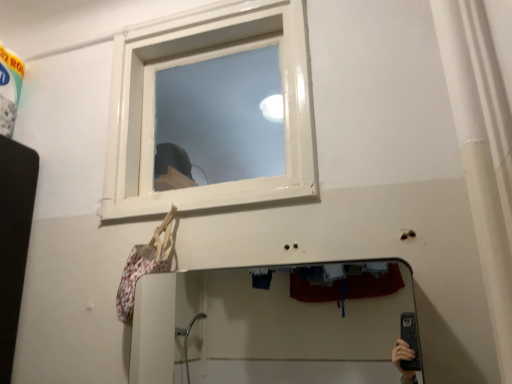
Find the location of a particular element. Image resolution: width=512 pixels, height=384 pixels. smooth glass mirror at lower center is located at coordinates (254, 326).

The width and height of the screenshot is (512, 384). Describe the element at coordinates (254, 326) in the screenshot. I see `smooth glass mirror at lower center` at that location.

Locate an element on the screen. white glossy window at upper center is located at coordinates (204, 59).

What do you see at coordinates (204, 59) in the screenshot?
I see `white glossy window at upper center` at bounding box center [204, 59].

In order to click on smooth glass mirror at lower center in this screenshot , I will do `click(254, 326)`.

Is white glossy window at upper center at the right side of smooth glass mirror at lower center?

No.

Is white glossy window at upper center positioned before smooth glass mirror at lower center?

No, white glossy window at upper center is further to the viewer.

Does point (131, 38) appear closer or farther from the camera than point (287, 307)?

Point (131, 38) is positioned closer to the camera compared to point (287, 307).

From the image's perspective, is white glossy window at upper center located above smooth glass mirror at lower center?

Yes.

In the scene shown: From a real-world perspective, is white glossy window at upper center physically located above or below smooth glass mirror at lower center?

white glossy window at upper center is situated higher than smooth glass mirror at lower center in the real world.

Considering the relative sizes of white glossy window at upper center and smooth glass mirror at lower center in the image provided, is white glossy window at upper center wider than smooth glass mirror at lower center?

Yes.

Is white glossy window at upper center shorter than smooth glass mirror at lower center?

Incorrect, the height of white glossy window at upper center does not fall short of that of smooth glass mirror at lower center.

Considering the sizes of objects white glossy window at upper center and smooth glass mirror at lower center in the image provided, who is bigger, white glossy window at upper center or smooth glass mirror at lower center?

white glossy window at upper center.

Is white glossy window at upper center outside of smooth glass mirror at lower center?

Yes.

Would you say white glossy window at upper center is a long distance from smooth glass mirror at lower center?

Yes, white glossy window at upper center is far from smooth glass mirror at lower center.

Is white glossy window at upper center oriented away from smooth glass mirror at lower center?

No, white glossy window at upper center's orientation is not away from smooth glass mirror at lower center.

How different are the orientations of white glossy window at upper center and smooth glass mirror at lower center in degrees?

They differ by 0.437 degrees in their facing directions.

This screenshot has width=512, height=384. Find the location of `window above the smooth glass mirror at lower center (from a real-world perspective)`. window above the smooth glass mirror at lower center (from a real-world perspective) is located at coordinates (204, 59).

Looking at this image, considering the relative positions of smooth glass mirror at lower center and white glossy window at upper center in the image provided, is smooth glass mirror at lower center to the left of white glossy window at upper center from the viewer's perspective?

No.

Is the position of smooth glass mirror at lower center more distant than that of white glossy window at upper center?

No.

Which is behind, point (351, 378) or point (106, 168)?

The point (351, 378) is farther.

Consider the image. From the image's perspective, is smooth glass mirror at lower center on white glossy window at upper center?

Incorrect, from the image's perspective, smooth glass mirror at lower center is lower than white glossy window at upper center.

From a real-world perspective, is smooth glass mirror at lower center positioned under white glossy window at upper center based on gravity?

Yes.

Which of these two, smooth glass mirror at lower center or white glossy window at upper center, is thinner?

smooth glass mirror at lower center is thinner.

Can you confirm if smooth glass mirror at lower center is taller than white glossy window at upper center?

No.

Can you confirm if smooth glass mirror at lower center is smaller than white glossy window at upper center?

Yes, smooth glass mirror at lower center is smaller than white glossy window at upper center.

Which is correct: smooth glass mirror at lower center is inside white glossy window at upper center, or outside of it?

smooth glass mirror at lower center is not inside white glossy window at upper center, it's outside.

Would you say smooth glass mirror at lower center is a long distance from white glossy window at upper center?

smooth glass mirror at lower center is far away from white glossy window at upper center.

Is smooth glass mirror at lower center oriented away from white glossy window at upper center?

No, white glossy window at upper center is not at the back of smooth glass mirror at lower center.

How different are the orientations of smooth glass mirror at lower center and white glossy window at upper center in degrees?

0.437 degrees.

Image resolution: width=512 pixels, height=384 pixels. What are the coordinates of `mirror on the right side of white glossy window at upper center` in the screenshot? It's located at (254, 326).

This screenshot has height=384, width=512. In the image, there is a white glossy window at upper center. Identify the location of mirror below it (from a real-world perspective). (254, 326).

At what (x,y) coordinates should I click in order to perform the action: click on window that appears above the smooth glass mirror at lower center (from a real-world perspective). Please return your answer as a coordinate pair (x, y). Looking at the image, I should click on (204, 59).